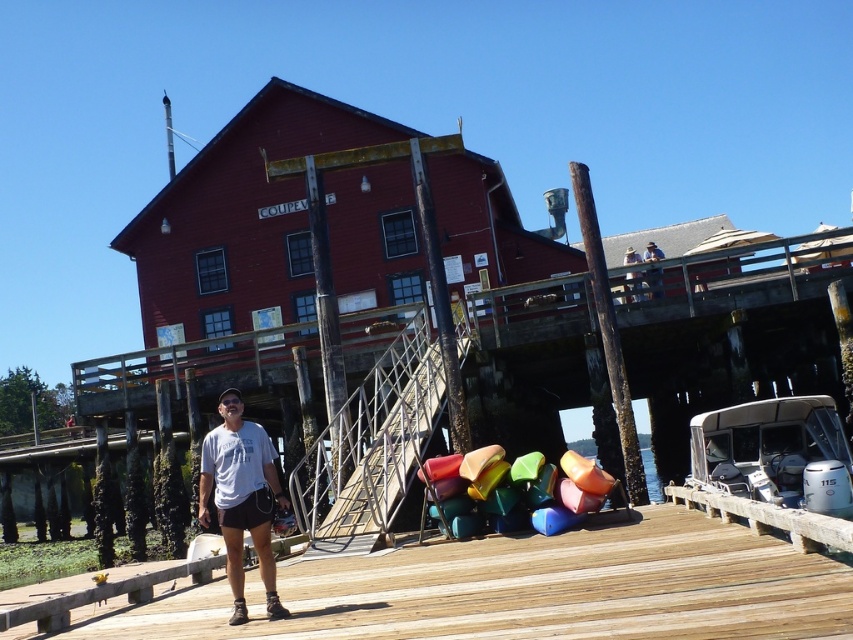
Which is more to the left, shiny plastic kayaks at center or transparent plastic water at lower center?

shiny plastic kayaks at center

Can you confirm if shiny plastic kayaks at center is positioned below transparent plastic water at lower center?

Actually, shiny plastic kayaks at center is above transparent plastic water at lower center.

Is point (558, 477) farther from camera compared to point (595, 461)?

No, (558, 477) is in front of (595, 461).

Locate an element on the screen. The height and width of the screenshot is (640, 853). shiny plastic kayaks at center is located at coordinates (514, 490).

Does wooden at center appear under white glossy boat at lower right?

Actually, wooden at center is above white glossy boat at lower right.

The width and height of the screenshot is (853, 640). I want to click on wooden at center, so click(526, 589).

Can you confirm if white glossy boat at lower right is positioned to the left of transparent plastic water at lower center?

Indeed, white glossy boat at lower right is positioned on the left side of transparent plastic water at lower center.

In the scene shown: Between white glossy boat at lower right and transparent plastic water at lower center, which one has more height?

Standing taller between the two is transparent plastic water at lower center.

Find the location of a particular element. The height and width of the screenshot is (640, 853). white glossy boat at lower right is located at coordinates (775, 452).